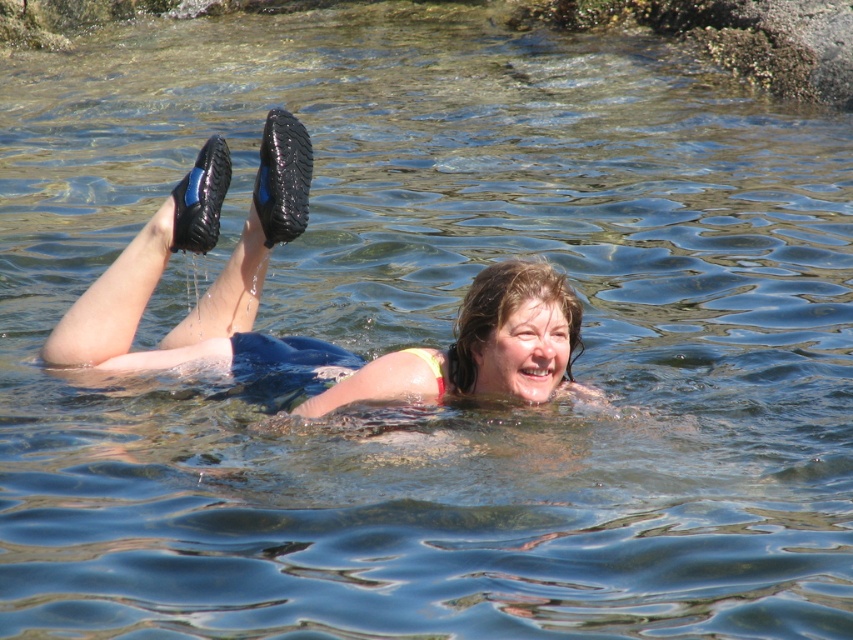
You are a photographer trying to capture the reflection of the matte black shoes at center and the black rubber boot at upper left in the water. Which object will have its reflection closer to the photographer?

The matte black shoes at center will have its reflection closer to the photographer because it is located below the black rubber boot at upper left, so its reflection would appear lower in the water from the photographer perspective.